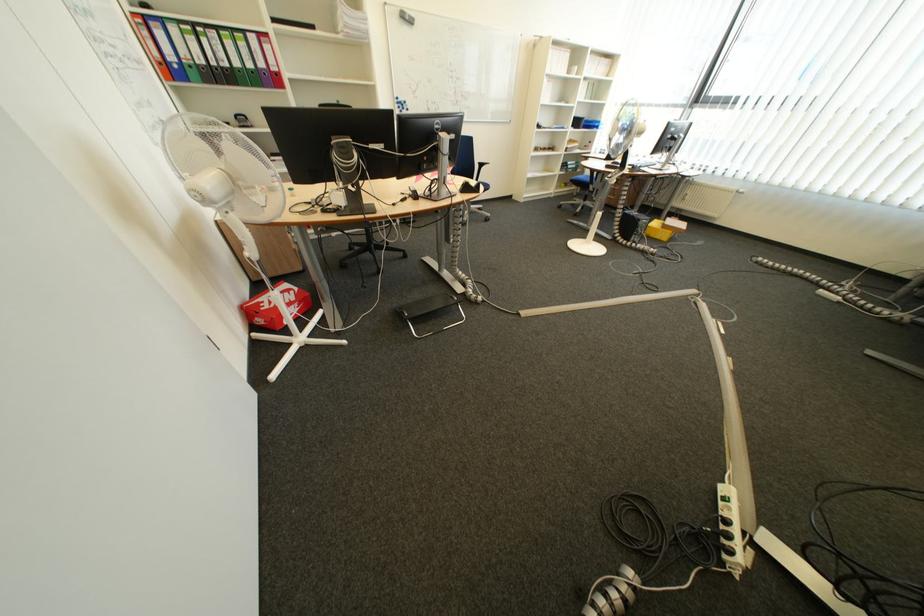
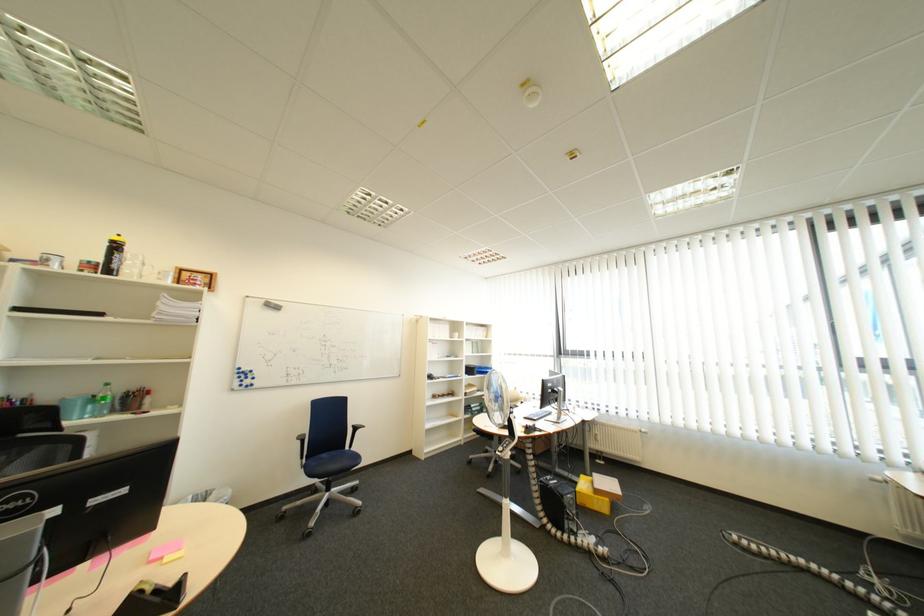
Find the pixel in the second image that matches (657,227) in the first image.

(585, 503)